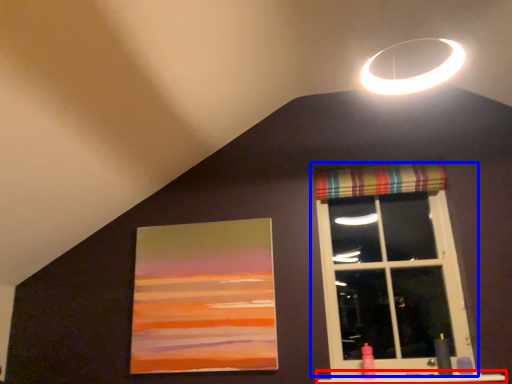
Question: Which point is further to the camera, window sill (highlighted by a red box) or window (highlighted by a blue box)?

Choices:
 (A) window sill
 (B) window

Answer: (B)